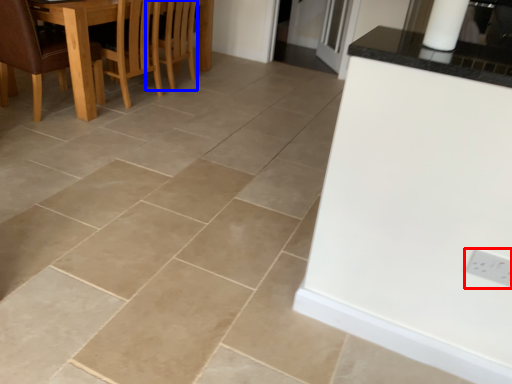
Question: Which object appears farthest to the camera in this image, electric outlet (highlighted by a red box) or armchair (highlighted by a blue box)?

Choices:
 (A) electric outlet
 (B) armchair

Answer: (B)